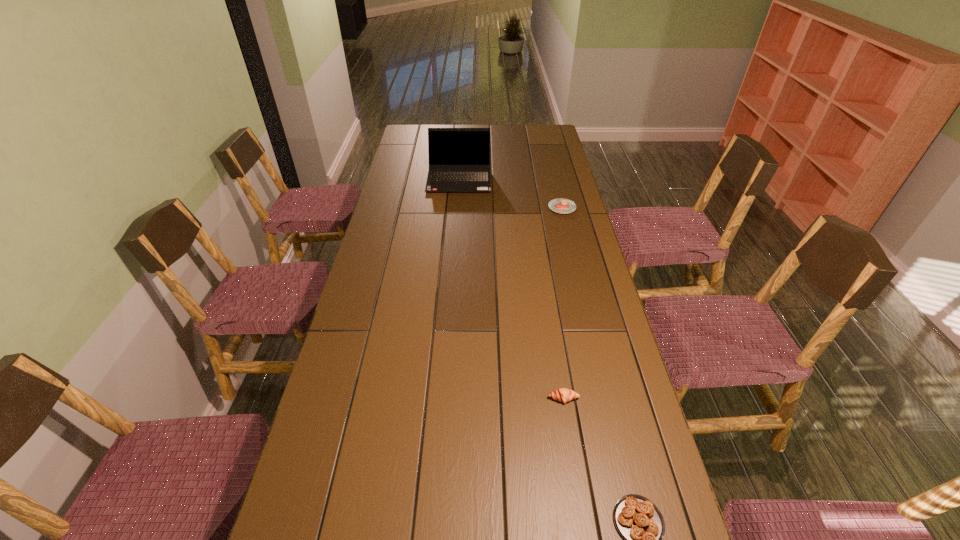
What are the coordinates of `the leftmost object` in the screenshot? It's located at point(459,158).

Where is `the farthest object`? The image size is (960, 540). the farthest object is located at coordinates (459, 158).

Locate an element on the screen. the farthest pastry is located at coordinates (560, 205).

Locate an element on the screen. Image resolution: width=960 pixels, height=540 pixels. the third object from right to left is located at coordinates (563, 395).

Where is `the leftmost pastry`? Image resolution: width=960 pixels, height=540 pixels. the leftmost pastry is located at coordinates (563, 395).

You are a GUI agent. You are given a task and a screenshot of the screen. Output one action in this format:
    pyautogui.click(x=<x>, y=<y>)
    Task: Click on the free space located on the screen of the tallest object
    
    Given the screenshot: What is the action you would take?
    pyautogui.click(x=454, y=250)

At what (x,y) coordinates should I click in order to perform the action: click on free location located on the front of the farthest pastry. Please return your answer as a coordinate pair (x, y). This screenshot has width=960, height=540. Looking at the image, I should click on (569, 235).

Identify the location of free region located 0.050m on the front-facing side of the second object from left to right. This screenshot has height=540, width=960. (567, 422).

The height and width of the screenshot is (540, 960). In order to click on vacant area at the left edge in this screenshot , I will do `click(396, 272)`.

Identify the location of free region at the right edge of the desktop. The width and height of the screenshot is (960, 540). (602, 369).